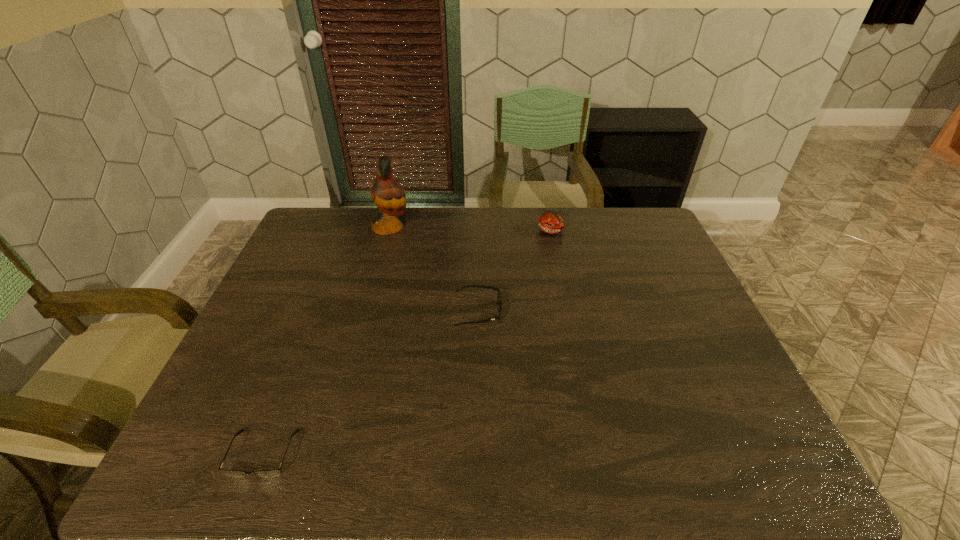
In the image, there is a desktop. In order to click on vacant space at the far right corner in this screenshot , I will do `click(659, 226)`.

Identify the location of vacant space that is in between the third tallest object and the second object from left to right. The image size is (960, 540). (434, 269).

Identify the location of vacant area that lies between the spectacles and the third farthest object. Image resolution: width=960 pixels, height=540 pixels. (371, 382).

Identify the location of vacant area that lies between the tomato and the second object from left to right. The width and height of the screenshot is (960, 540). (471, 228).

Find the location of a particular element. Image resolution: width=960 pixels, height=540 pixels. vacant space that's between the leftmost object and the second object from left to right is located at coordinates (326, 340).

This screenshot has width=960, height=540. Identify the location of free spot between the third shortest object and the tallest object. (471, 228).

You are a GUI agent. You are given a task and a screenshot of the screen. Output one action in this format:
    pyautogui.click(x=<x>, y=<y>)
    Task: Click on the empty space that is in between the tomato and the second shortest object
    
    Given the screenshot: What is the action you would take?
    pyautogui.click(x=516, y=271)

Locate an element on the screen. Image resolution: width=960 pixels, height=540 pixels. free spot between the shortest object and the third farthest object is located at coordinates (371, 382).

The height and width of the screenshot is (540, 960). Identify the location of vacant area between the spectacles and the third object from right to left. (326, 340).

Find the location of a particular element. The height and width of the screenshot is (540, 960). free point between the tallest object and the leftmost object is located at coordinates (326, 340).